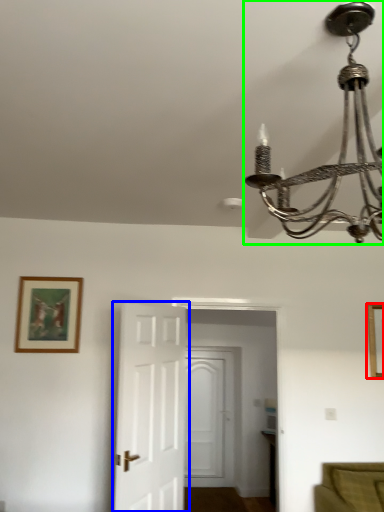
Question: Considering the real-world distances, which object is closest to picture frame (highlighted by a red box)? door (highlighted by a blue box) or lamp (highlighted by a green box).

Choices:
 (A) door
 (B) lamp

Answer: (A)